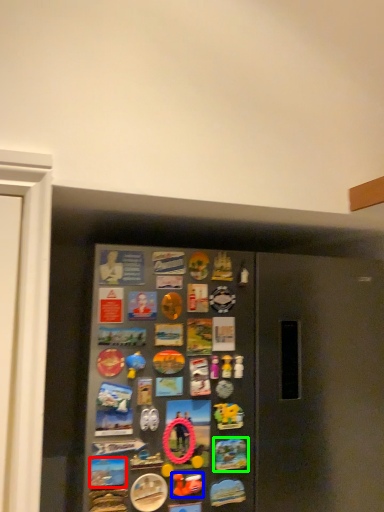
Question: Estimate the real-world distances between objects in this image. Which object is closer to button (highlighted by a red box), art (highlighted by a blue box) or button (highlighted by a green box)?

Choices:
 (A) art
 (B) button

Answer: (A)